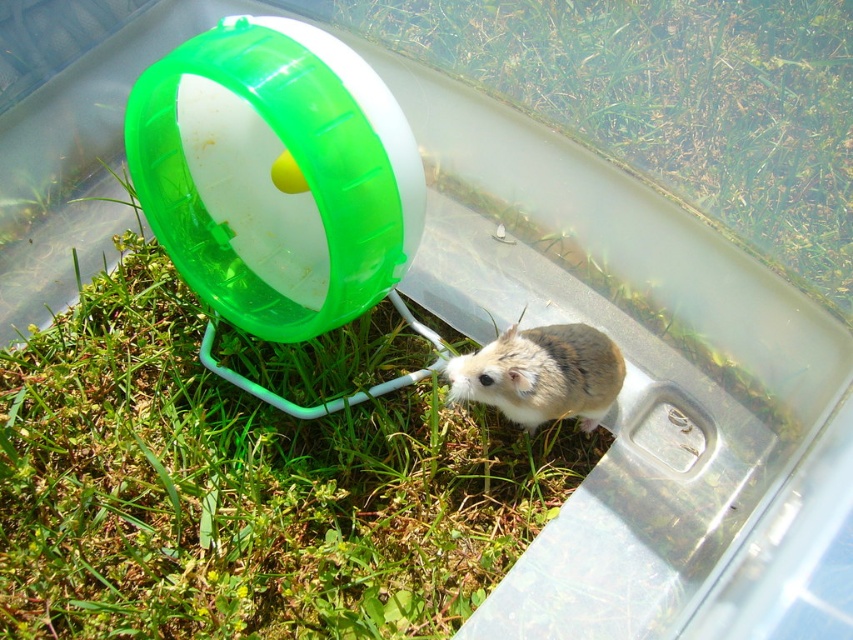
Question: Does green grass at lower center have a lesser width compared to fuzzy brown hamster at center?

Choices:
 (A) yes
 (B) no

Answer: (B)

Question: Which of the following is the closest to the observer?

Choices:
 (A) fuzzy brown hamster at center
 (B) green grass at lower left
 (C) green grass at lower center

Answer: (C)

Question: Which object appears closest to the camera in this image?

Choices:
 (A) fuzzy brown hamster at center
 (B) green grass at lower center

Answer: (B)

Question: Does green grass at lower left have a smaller size compared to fuzzy brown hamster at center?

Choices:
 (A) yes
 (B) no

Answer: (B)

Question: Which point is farther from the camera taking this photo?

Choices:
 (A) (532, 502)
 (B) (512, 400)
 (C) (759, 221)

Answer: (A)

Question: Can you confirm if green grass at lower center is smaller than fuzzy brown hamster at center?

Choices:
 (A) yes
 (B) no

Answer: (B)